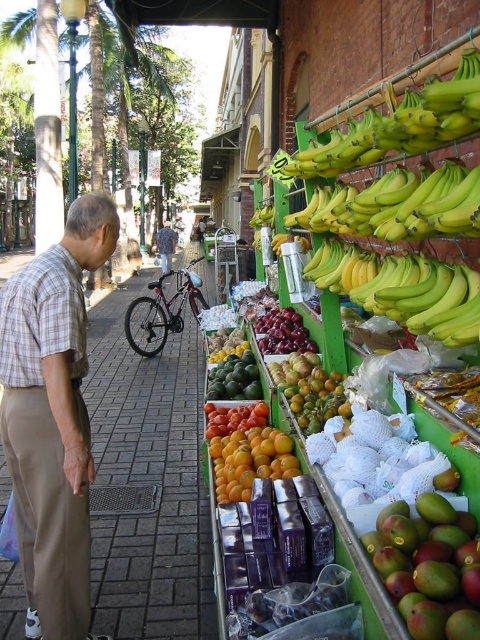
Is green matte avocados at center below camouflage jacket at center?

Correct, green matte avocados at center is located below camouflage jacket at center.

Can you confirm if green matte avocados at center is smaller than camouflage jacket at center?

Correct, green matte avocados at center occupies less space than camouflage jacket at center.

Measure the distance between green matte avocados at center and camera.

12.92 feet

In order to click on green matte avocados at center in this screenshot , I will do `click(235, 378)`.

Which is more to the left, shiny red tomatoes at center or camouflage jacket at center?

camouflage jacket at center

Is shiny red tomatoes at center closer to camera compared to camouflage jacket at center?

Yes, shiny red tomatoes at center is closer to the viewer.

Which is behind, point (264, 416) or point (164, 236)?

The point (164, 236) is behind.

At what (x,y) coordinates should I click in order to perform the action: click on shiny red tomatoes at center. Please return your answer as a coordinate pair (x, y). Looking at the image, I should click on (233, 419).

Can you confirm if orangesmoothfruit at center is shorter than green matte avocados at center?

Correct, orangesmoothfruit at center is not as tall as green matte avocados at center.

Can you confirm if orangesmoothfruit at center is taller than green matte avocados at center?

No.

Does point (232, 474) lie behind point (223, 392)?

That is False.

You are a GUI agent. You are given a task and a screenshot of the screen. Output one action in this format:
    pyautogui.click(x=<x>, y=<y>)
    Task: Click on the orangesmoothfruit at center
    
    Given the screenshot: What is the action you would take?
    pyautogui.click(x=250, y=460)